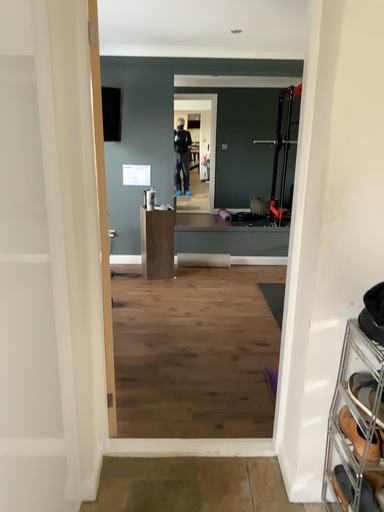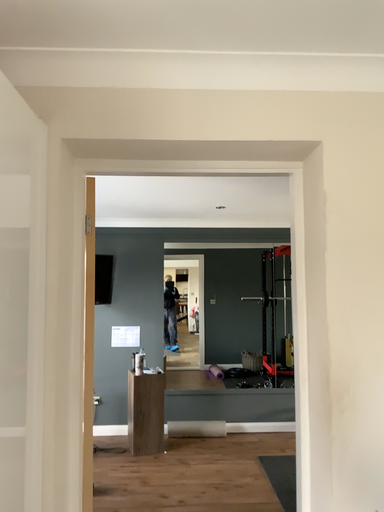
Question: Which way did the camera rotate in the video?

Choices:
 (A) rotated downward
 (B) rotated upward

Answer: (B)